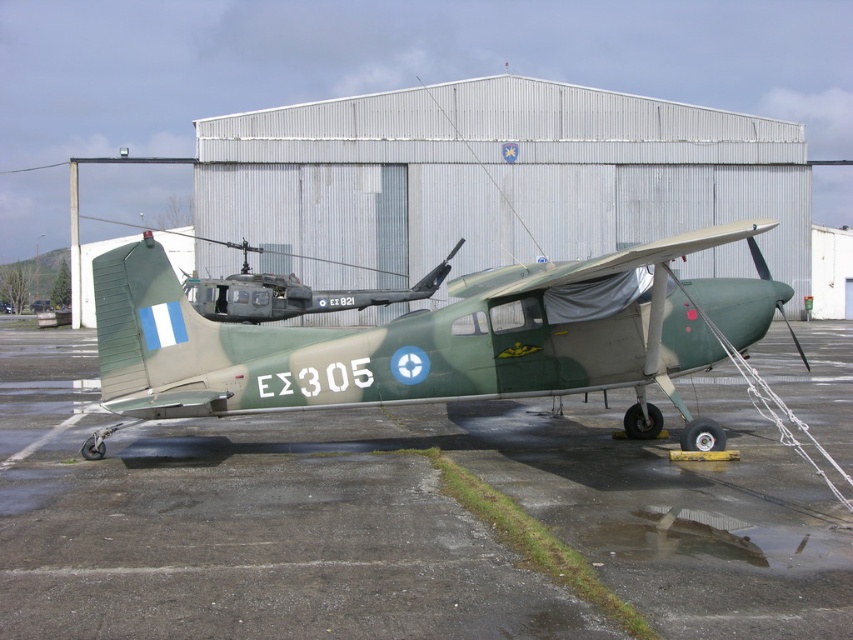
Is point (424, 538) positioned behind point (253, 314)?

No.

You are a GUI agent. You are given a task and a screenshot of the screen. Output one action in this format:
    pyautogui.click(x=<x>, y=<y>)
    Task: Click on the smooth asphalt tarmac at center
    Image resolution: width=853 pixels, height=640 pixels.
    Given the screenshot: What is the action you would take?
    pyautogui.click(x=393, y=518)

This screenshot has width=853, height=640. I want to click on smooth asphalt tarmac at center, so click(x=393, y=518).

Between smooth asphalt tarmac at center and camouflage paint airplane at center, which one is positioned lower?

smooth asphalt tarmac at center is lower down.

Between smooth asphalt tarmac at center and camouflage paint airplane at center, which one is positioned higher?

camouflage paint airplane at center is higher up.

The height and width of the screenshot is (640, 853). Identify the location of smooth asphalt tarmac at center. (393, 518).

Is camouflage paint airplane at center wider than matte green helicopter at center?

Incorrect, camouflage paint airplane at center's width does not surpass matte green helicopter at center's.

Where is `camouflage paint airplane at center`? camouflage paint airplane at center is located at coordinates (439, 339).